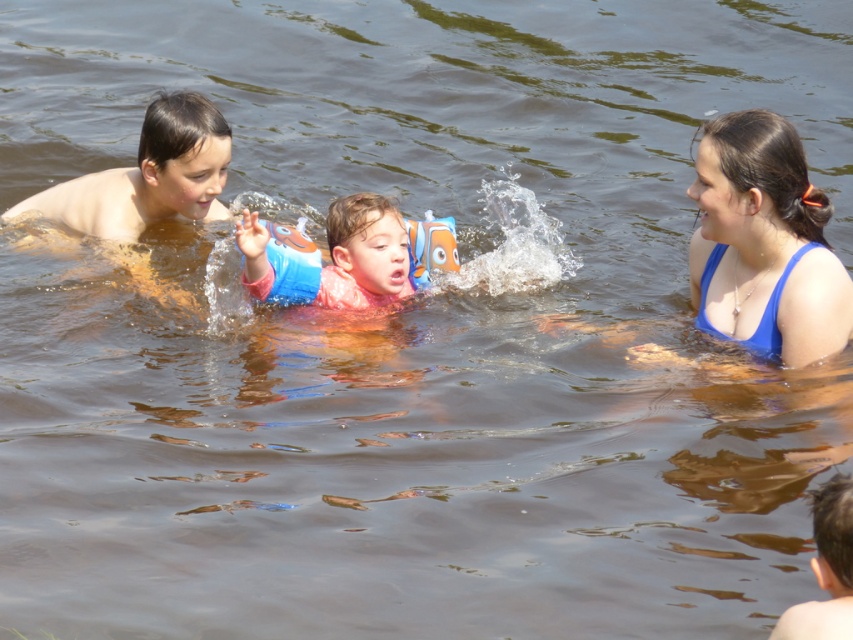
Measure the distance from blue fabric at right to light brown skin at left.

A distance of 9.65 feet exists between blue fabric at right and light brown skin at left.

Which is more to the right, blue fabric at right or light brown skin at left?

blue fabric at right is more to the right.

Between point (838, 269) and point (221, 144), which one is positioned in front?

Point (838, 269) is more forward.

Locate an element on the screen. The image size is (853, 640). blue fabric at right is located at coordinates (764, 244).

Which is more to the right, light brown skin at left or blue rubber arm band at center?

From the viewer's perspective, blue rubber arm band at center appears more on the right side.

Which is above, light brown skin at left or blue rubber arm band at center?

light brown skin at left is higher up.

Where is `light brown skin at left`? The height and width of the screenshot is (640, 853). light brown skin at left is located at coordinates (146, 188).

This screenshot has width=853, height=640. What do you see at coordinates (335, 257) in the screenshot?
I see `blue rubber arm band at center` at bounding box center [335, 257].

Does blue rubber arm band at center appear over blonde hair boy at lower right?

Indeed, blue rubber arm band at center is positioned over blonde hair boy at lower right.

Is point (396, 236) positioned behind point (822, 636)?

Yes.

You are a GUI agent. You are given a task and a screenshot of the screen. Output one action in this format:
    pyautogui.click(x=<x>, y=<y>)
    Task: Click on the blue rubber arm band at center
    Image resolution: width=853 pixels, height=640 pixels.
    Given the screenshot: What is the action you would take?
    pyautogui.click(x=335, y=257)